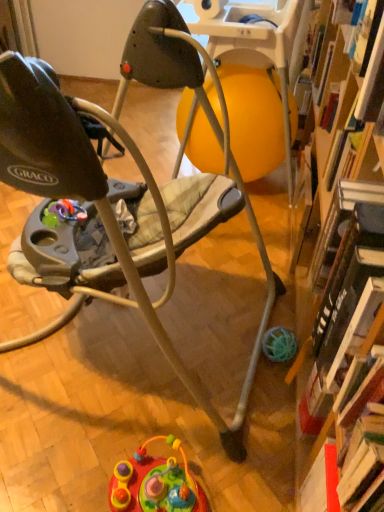
Question: Which is correct: multicolored plastic toy at lower center is inside matte gray baby walker at center, or outside of it?

Choices:
 (A) outside
 (B) inside

Answer: (A)

Question: Is multicolored plastic toy at lower center taller or shorter than matte gray baby walker at center?

Choices:
 (A) tall
 (B) short

Answer: (B)

Question: From a real-world perspective, is multicolored plastic toy at lower center above or below matte gray baby walker at center?

Choices:
 (A) below
 (B) above

Answer: (A)

Question: From the image's perspective, is matte gray baby walker at center above or below multicolored plastic toy at lower center?

Choices:
 (A) above
 (B) below

Answer: (A)

Question: Relative to multicolored plastic toy at lower center, is matte gray baby walker at center in front or behind?

Choices:
 (A) front
 (B) behind

Answer: (A)

Question: From a real-world perspective, is matte gray baby walker at center positioned above or below multicolored plastic toy at lower center?

Choices:
 (A) below
 (B) above

Answer: (B)

Question: Visually, is matte gray baby walker at center positioned to the left or to the right of multicolored plastic toy at lower center?

Choices:
 (A) right
 (B) left

Answer: (B)